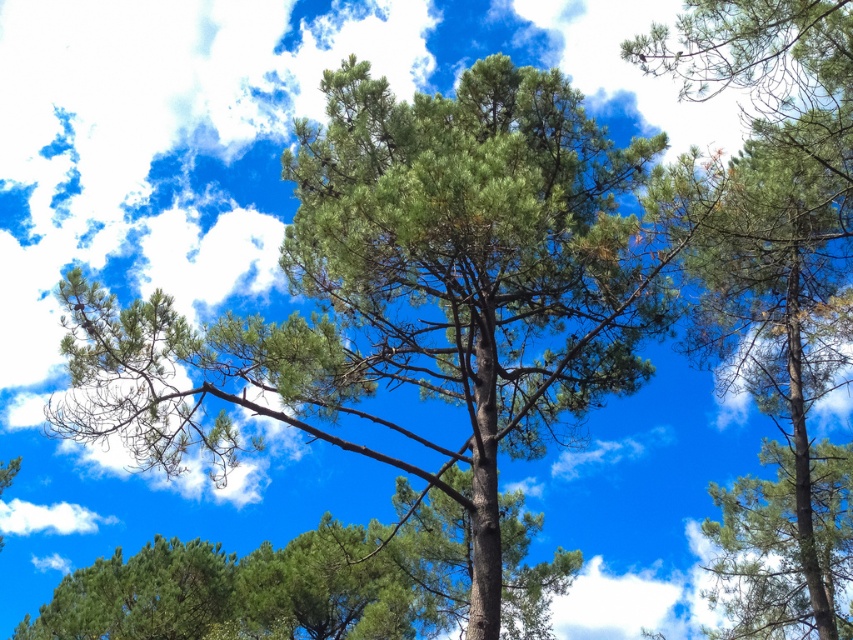
Question: Which point is closer to the camera?

Choices:
 (A) (799, 320)
 (B) (517, 129)

Answer: (B)

Question: From the image, what is the correct spatial relationship of green needle-like at center in relation to green needle-like at upper right?

Choices:
 (A) right
 (B) left

Answer: (B)

Question: Does green needle-like at center lie behind green needle-like at upper right?

Choices:
 (A) yes
 (B) no

Answer: (B)

Question: Does green needle-like at center have a larger size compared to green needle-like at upper right?

Choices:
 (A) no
 (B) yes

Answer: (B)

Question: Which of the following is the farthest from the observer?

Choices:
 (A) green needle-like at upper right
 (B) green needle-like at center

Answer: (A)